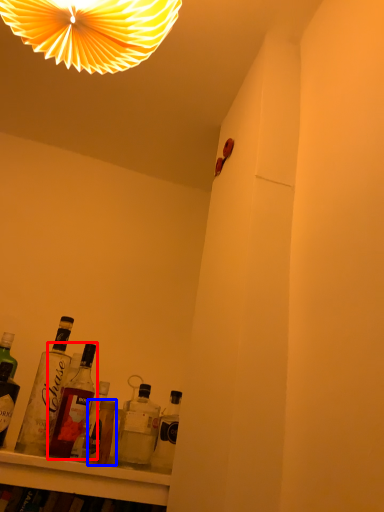
Question: Among these objects, which one is nearest to the camera, bottle (highlighted by a red box) or bottle (highlighted by a blue box)?

Choices:
 (A) bottle
 (B) bottle

Answer: (B)